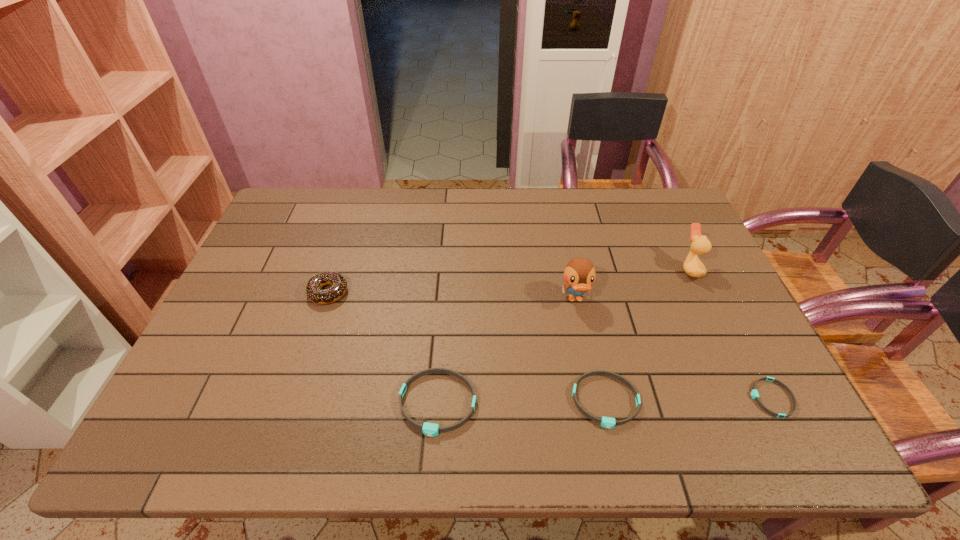
The height and width of the screenshot is (540, 960). What are the coordinates of `vacant space at the far edge of the desktop` in the screenshot? It's located at (409, 204).

This screenshot has width=960, height=540. In the image, there is a desktop. Find the location of `vacant region at the near edge`. vacant region at the near edge is located at coordinates (262, 374).

Where is `vacant space at the left edge of the desktop`? This screenshot has height=540, width=960. vacant space at the left edge of the desktop is located at coordinates (278, 239).

Locate an element on the screen. The width and height of the screenshot is (960, 540). vacant space at the right edge of the desktop is located at coordinates (704, 335).

Identify the location of vacant space at the far left corner of the desktop. (283, 217).

Identify the location of vacant space at the near left corner of the desktop. This screenshot has height=540, width=960. (202, 386).

Locate an element on the screen. The width and height of the screenshot is (960, 540). vacant area between the left duck and the second shortest wristband is located at coordinates (590, 350).

At what (x,y) coordinates should I click in order to perform the action: click on vacant point located between the shortest object and the second wristband from right to left. Please return your answer as a coordinate pair (x, y). This screenshot has width=960, height=540. Looking at the image, I should click on (688, 399).

Where is `free spot between the leftmost wristband and the shortest wristband`? free spot between the leftmost wristband and the shortest wristband is located at coordinates (605, 401).

Where is `unoccupied area between the left duck and the leftmost object`? unoccupied area between the left duck and the leftmost object is located at coordinates (452, 296).